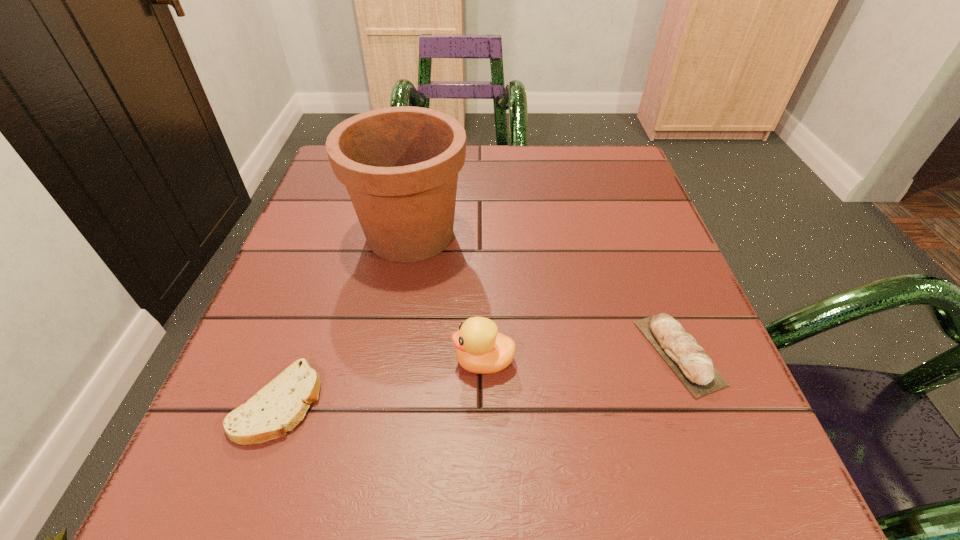
The width and height of the screenshot is (960, 540). What are the coordinates of `vacant space located on the face of the duckling` in the screenshot? It's located at 332,362.

This screenshot has width=960, height=540. I want to click on free spot located 0.130m on the back of the second shortest object, so click(643, 261).

Find the location of `blank space located 0.380m on the right of the left pita bread`. blank space located 0.380m on the right of the left pita bread is located at coordinates (580, 402).

Find the location of a particular element. object that is at the near edge is located at coordinates (278, 407).

Find the location of a particular element. The height and width of the screenshot is (540, 960). flowerpot that is at the left edge is located at coordinates (400, 165).

Where is `pita bread present at the left edge`? This screenshot has height=540, width=960. pita bread present at the left edge is located at coordinates (278, 407).

At what (x,y) coordinates should I click in order to perform the action: click on object located at the right edge. Please return your answer as a coordinate pair (x, y). The image size is (960, 540). Looking at the image, I should click on (689, 361).

This screenshot has width=960, height=540. I want to click on object that is positioned at the near left corner, so click(278, 407).

Locate an element on the screen. This screenshot has width=960, height=540. vacant region at the far edge of the desktop is located at coordinates (557, 147).

I want to click on vacant space at the near edge, so click(481, 508).